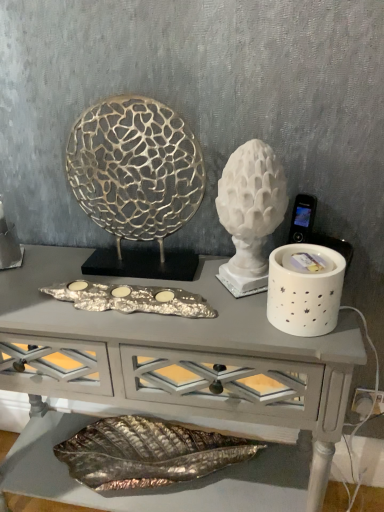
Find the location of a particular element. This screenshot has width=384, height=512. vacant position to the left of white ceramic candle holder at right is located at coordinates (218, 320).